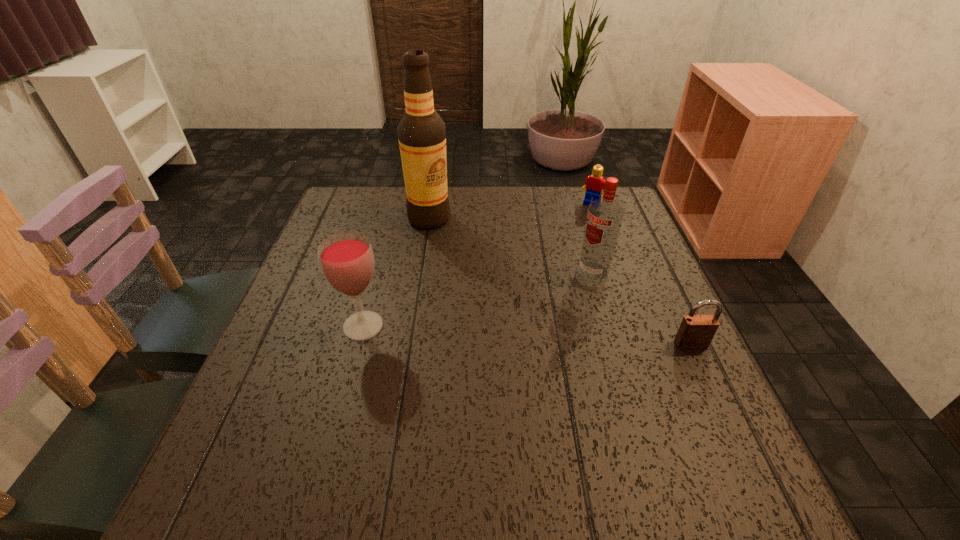
You are a GUI agent. You are given a task and a screenshot of the screen. Output one action in this format:
    pyautogui.click(x=<x>, y=<y>)
    Task: Click on the free space between the rightmost object and the Lego
    
    Given the screenshot: What is the action you would take?
    pyautogui.click(x=641, y=274)

In order to click on free spot between the padlock and the Lego in this screenshot , I will do `click(641, 274)`.

This screenshot has width=960, height=540. In order to click on free space between the third shortest object and the tallest object in this screenshot , I will do `click(396, 272)`.

The height and width of the screenshot is (540, 960). What are the coordinates of `free space between the Lego and the tallest object` in the screenshot? It's located at (511, 211).

The image size is (960, 540). In order to click on vacant area that lies between the Lego and the wineglass in this screenshot , I will do `click(477, 265)`.

The width and height of the screenshot is (960, 540). In order to click on free spot between the tallest object and the padlock in this screenshot , I will do `click(560, 281)`.

The width and height of the screenshot is (960, 540). What are the coordinates of `vacant region between the third shortest object and the Lego` in the screenshot? It's located at (477, 265).

Locate an element on the screen. The image size is (960, 540). empty location between the padlock and the alcohol is located at coordinates (560, 281).

Identify the location of vacant point located between the wineglass and the alcohol. Image resolution: width=960 pixels, height=540 pixels. [396, 272].

Identify which object is the second closest to the wineglass. Please provide its 2D coordinates. Your answer should be formatted as a tuple, i.e. [(x, y)], where the tuple contains the x and y coordinates of a point satisfying the conditions above.

[(604, 217)]